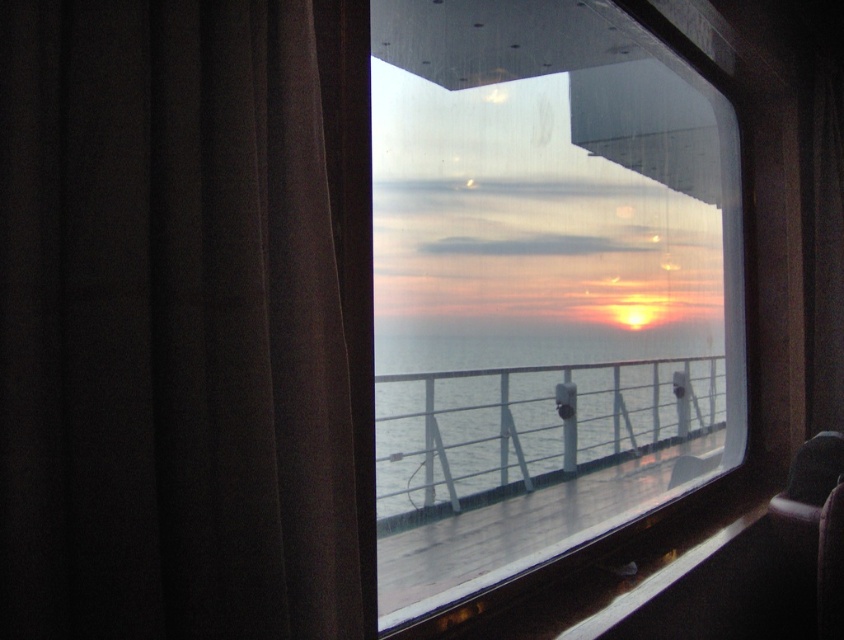
What do you see at coordinates (169, 326) in the screenshot?
I see `brown fabric curtain at left` at bounding box center [169, 326].

Does point (9, 4) come in front of point (663, 134)?

Yes.

This screenshot has height=640, width=844. In order to click on brown fabric curtain at left in this screenshot , I will do `click(169, 326)`.

Between transparent glass window at center and clear water at center, which one appears on the right side from the viewer's perspective?

transparent glass window at center

Can you confirm if transparent glass window at center is positioned below clear water at center?

Actually, transparent glass window at center is above clear water at center.

Which is in front, point (540, 276) or point (637, 412)?

Positioned in front is point (540, 276).

Where is `transparent glass window at center`? transparent glass window at center is located at coordinates (542, 282).

Is brown fabric curtain at left closer to camera compared to clear water at center?

That is True.

Can you confirm if brown fabric curtain at left is positioned to the right of clear water at center?

Incorrect, brown fabric curtain at left is not on the right side of clear water at center.

You are a GUI agent. You are given a task and a screenshot of the screen. Output one action in this format:
    pyautogui.click(x=<x>, y=<y>)
    Task: Click on the brown fabric curtain at left
    The height and width of the screenshot is (640, 844).
    Given the screenshot: What is the action you would take?
    click(169, 326)

Where is `brown fabric curtain at left`? The image size is (844, 640). brown fabric curtain at left is located at coordinates point(169,326).